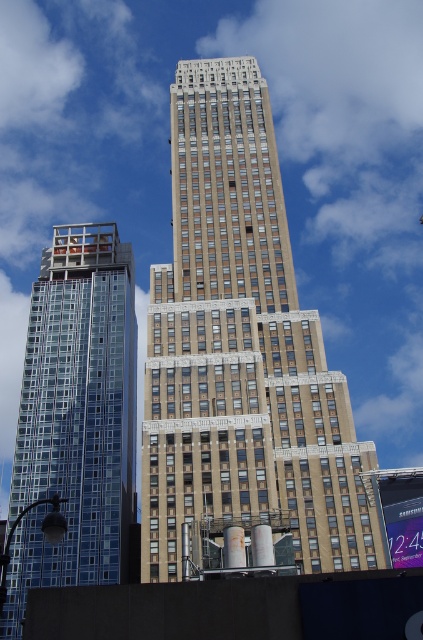
Where is `brown stone building at center`? brown stone building at center is located at coordinates (241, 355).

Who is higher up, brown stone building at center or glassy blue skyscraper at left?

brown stone building at center is higher up.

Find the location of a particular element. This screenshot has width=423, height=640. brown stone building at center is located at coordinates (241, 355).